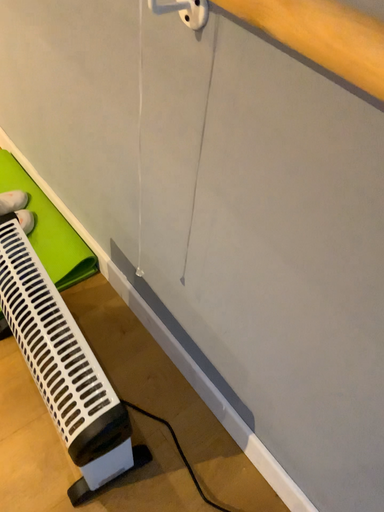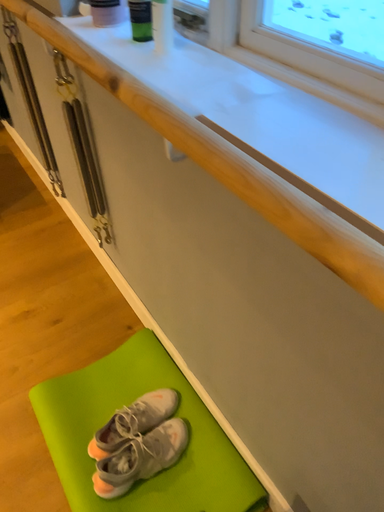
Question: How did the camera likely rotate when shooting the video?

Choices:
 (A) rotated left
 (B) rotated right

Answer: (A)